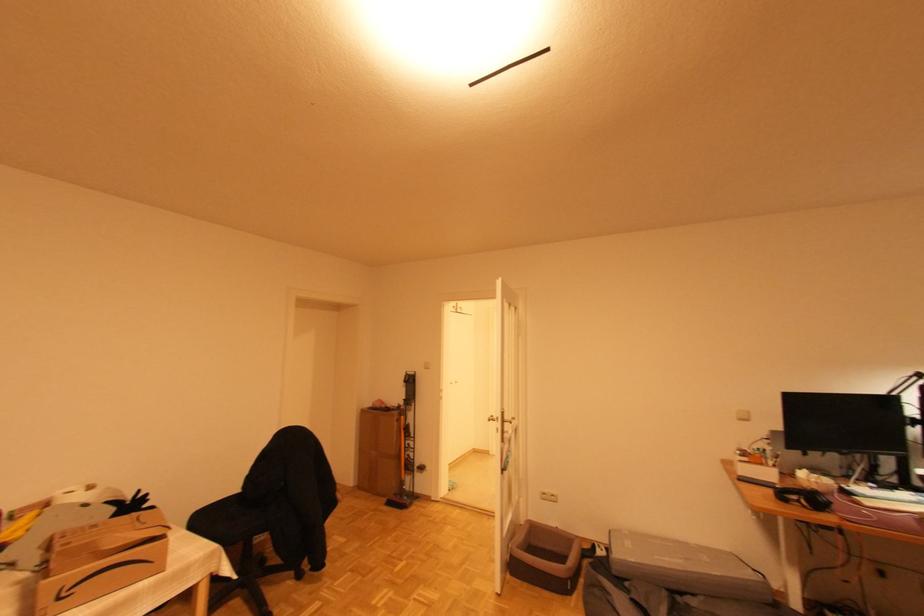
What are the coordinates of `orange broom handle` in the screenshot? It's located at (405, 460).